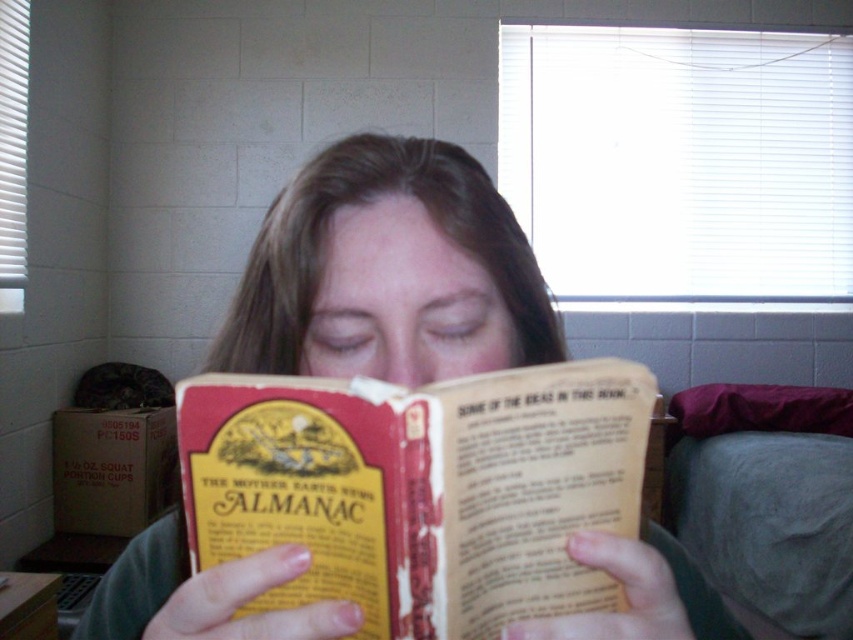
You are an interior designer assessing the space for storage solutions. You notice the yellow paper almanac at center and the smooth brown hair at center. Which object occupies more space in the room?

The smooth brown hair at center occupies more space than the yellow paper almanac at center.

You are standing in the room and want to pick up an object. If you have to choose between the object at point (488, 490) and the object at point (335, 204), which one would be easier to reach?

The object at point (488, 490) is closer to the camera than the object at (335, 204), so it would be easier to reach.

What is the exact location of the yellow paper almanac at center in the image?

The yellow paper almanac at center is located at point coordinates of (421, 490).